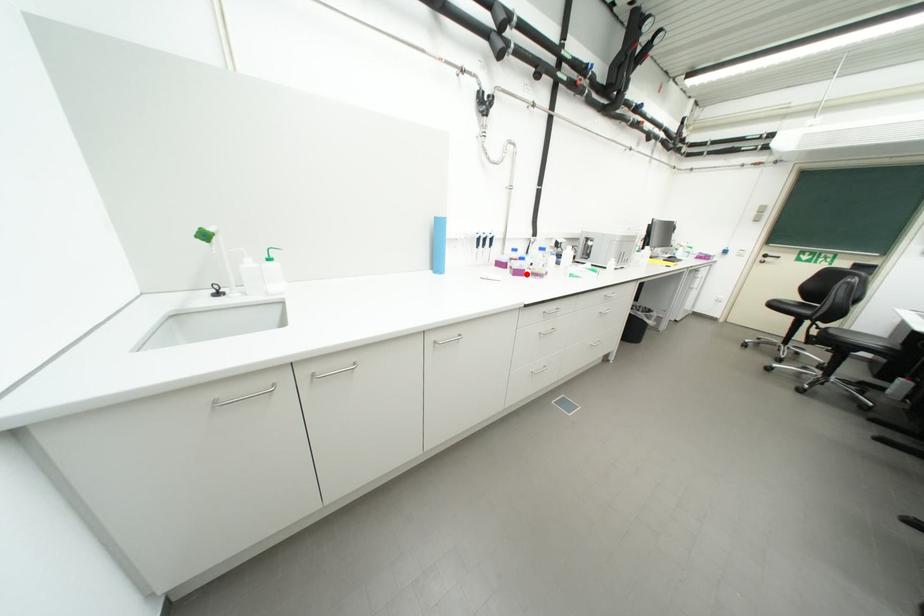
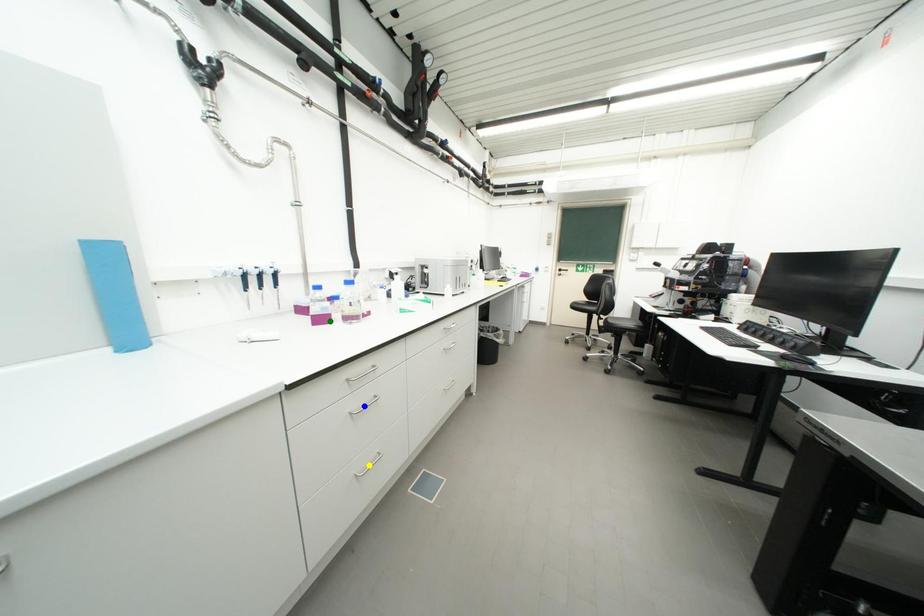
Question: I am providing you with two images of the same scene from different viewpoints. A red point is marked on the first image. You are given multiple points on the second image. In image 2, which mark is for the same physical point as the one in image 1?

Choices:
 (A) yellow point
 (B) blue point
 (C) green point

Answer: (C)